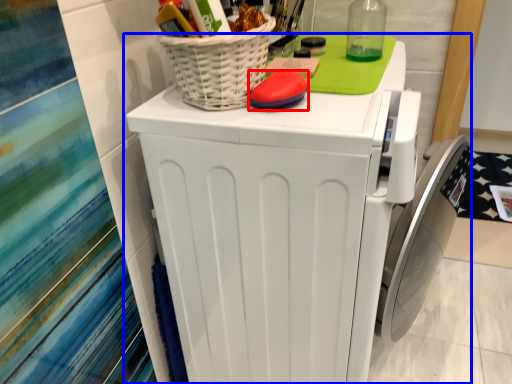
Question: Which object appears farthest to the camera in this image, soap (highlighted by a red box) or home appliance (highlighted by a blue box)?

Choices:
 (A) soap
 (B) home appliance

Answer: (A)